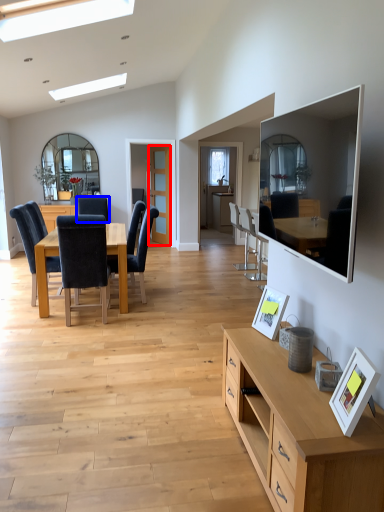
Question: Among these objects, which one is nearest to the camera, glass door (highlighted by a red box) or chair (highlighted by a blue box)?

Choices:
 (A) glass door
 (B) chair

Answer: (B)